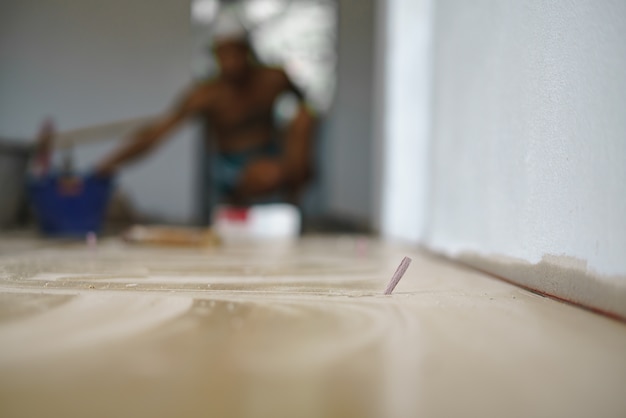
Locate an element on the screen. The width and height of the screenshot is (626, 418). blue bucket is located at coordinates (62, 202).